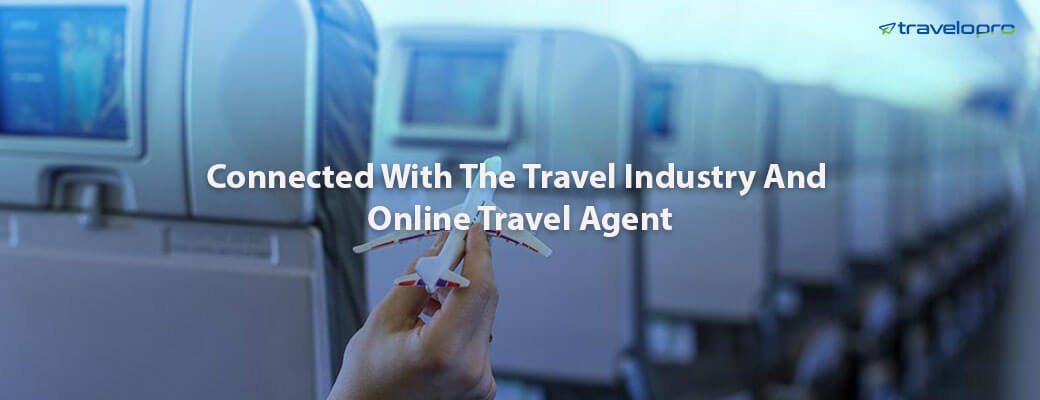
This screenshot has height=400, width=1040. What are the coordinates of `seat` in the screenshot? It's located at (234, 296).